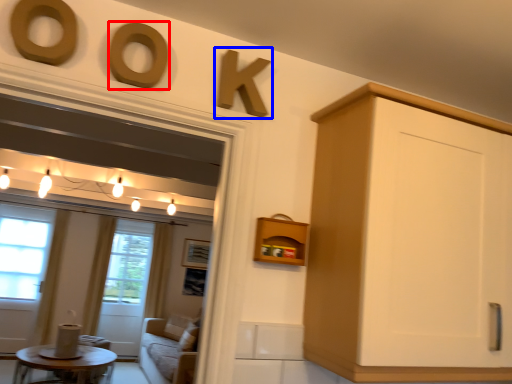
Question: Which object appears farthest to the camera in this image, oval (highlighted by a red box) or number (highlighted by a blue box)?

Choices:
 (A) oval
 (B) number

Answer: (B)